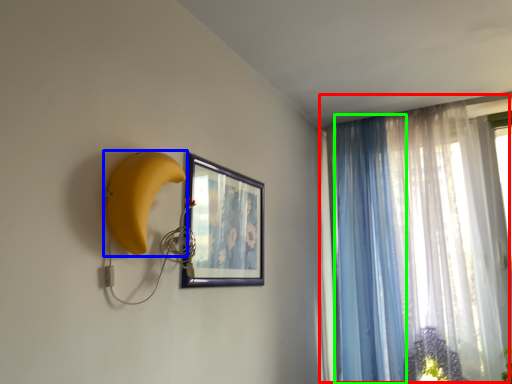
Question: Which object is the closest to the curtain (highlighted by a red box)? Choose among these: banana (highlighted by a blue box) or curtain (highlighted by a green box).

Choices:
 (A) banana
 (B) curtain

Answer: (B)